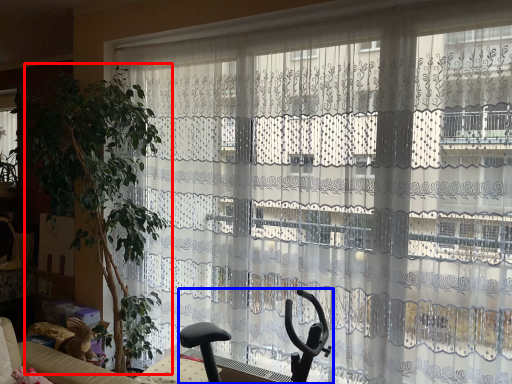
Question: Which of the following is the closest to the observer, plant (highlighted by a red box) or swivel chair (highlighted by a blue box)?

Choices:
 (A) plant
 (B) swivel chair

Answer: (B)